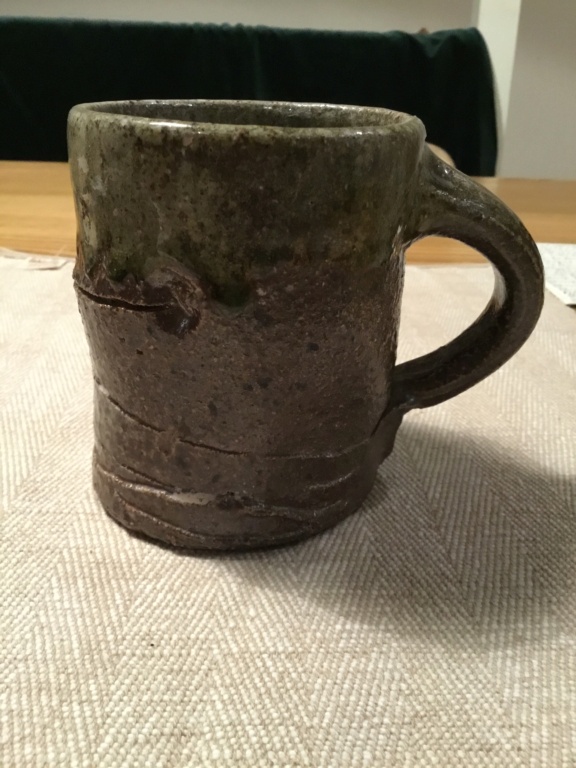
Where is `shadow of mug table mat`? The width and height of the screenshot is (576, 768). shadow of mug table mat is located at coordinates (415, 501).